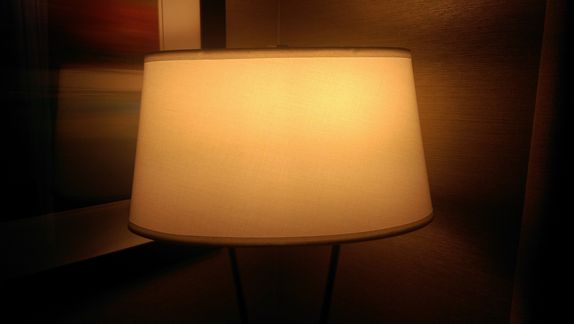
The height and width of the screenshot is (324, 574). Identify the location of lamp. (266, 156).